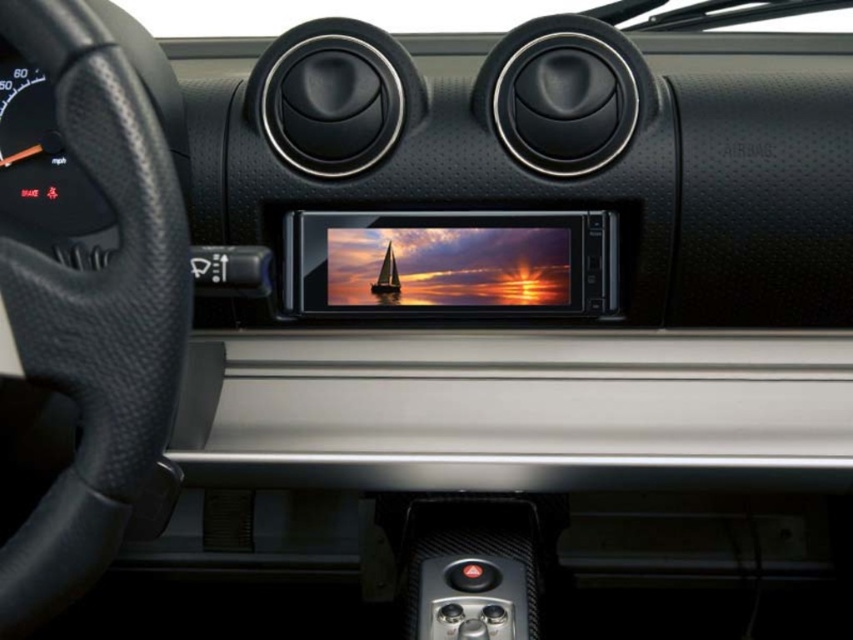
Question: Which point is closer to the camera?

Choices:
 (A) black leather steering wheel at left
 (B) satin black sailboat at center

Answer: (A)

Question: Which of the following is the closest to the observer?

Choices:
 (A) (99, 164)
 (B) (370, 284)

Answer: (A)

Question: From the image, what is the correct spatial relationship of black leather steering wheel at left in relation to satin black sailboat at center?

Choices:
 (A) below
 (B) above

Answer: (A)

Question: Can you confirm if black leather steering wheel at left is bigger than satin black sailboat at center?

Choices:
 (A) no
 (B) yes

Answer: (B)

Question: Can you confirm if black leather steering wheel at left is wider than satin black sailboat at center?

Choices:
 (A) yes
 (B) no

Answer: (A)